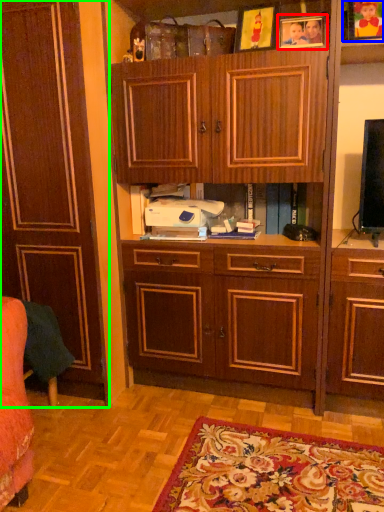
Question: Which object is the farthest from picture frame (highlighted by a red box)? Choose among these: picture frame (highlighted by a blue box) or cabinetry (highlighted by a green box).

Choices:
 (A) picture frame
 (B) cabinetry

Answer: (B)